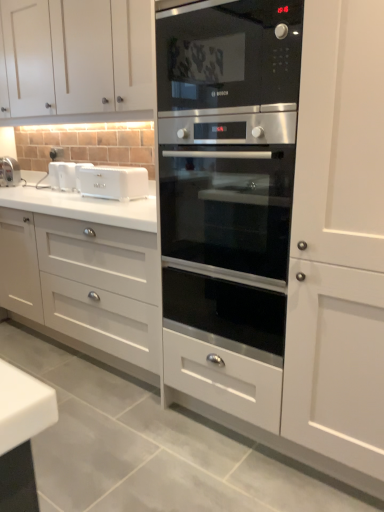
The width and height of the screenshot is (384, 512). Describe the element at coordinates (228, 168) in the screenshot. I see `stainless steel oven at center` at that location.

Locate an element on the screen. matte white faucet at left is located at coordinates (9, 172).

Locate an element on the screen. white matte cabinet at upper left is located at coordinates (75, 57).

This screenshot has height=512, width=384. Describe the element at coordinates (113, 182) in the screenshot. I see `white plastic toaster at center, which ranks as the 1th appliance in front-to-back order` at that location.

Measure the distance between white plastic toaster at left, acting as the 2th appliance starting from the front, and camera.

The distance of white plastic toaster at left, acting as the 2th appliance starting from the front, from camera is 2.84 meters.

Identify the location of white plastic toaster at left, the first appliance from the left. This screenshot has width=384, height=512. (62, 176).

Image resolution: width=384 pixels, height=512 pixels. I want to click on stainless steel oven at center, so click(x=228, y=168).

Is white matte cabinet at upper left oriented away from white plastic toaster at left, the first appliance from the left?

→ No.

From their relative heights in the image, would you say white matte cabinet at upper left is taller or shorter than white plastic toaster at left, which appears as the first appliance when viewed from the back?

In the image, white matte cabinet at upper left appears to be taller than white plastic toaster at left, which appears as the first appliance when viewed from the back.

Would you say white matte cabinet at upper left is a long distance from white plastic toaster at left, which appears as the first appliance when viewed from the back?

That's not correct — white matte cabinet at upper left is a little close to white plastic toaster at left, which appears as the first appliance when viewed from the back.

Considering the sizes of objects stainless steel oven at center and white matte cabinet at upper left in the image provided, who is wider, stainless steel oven at center or white matte cabinet at upper left?

With larger width is stainless steel oven at center.

The height and width of the screenshot is (512, 384). Identify the location of oven below the white matte cabinet at upper left (from a real-world perspective). (228, 168).

From the image's perspective, who appears lower, stainless steel oven at center or white matte cabinet at upper left?

stainless steel oven at center, from the image's perspective.

Is stainless steel oven at center spatially inside white matte cabinet at upper left, or outside of it?

stainless steel oven at center exists outside the volume of white matte cabinet at upper left.

How far apart are matte white faucet at left and black glass microwave at center?

They are 2.16 meters apart.

Looking at their sizes, would you say matte white faucet at left is wider or thinner than black glass microwave at center?

matte white faucet at left is thinner than black glass microwave at center.

Is black glass microwave at center inside matte white faucet at left?

That's incorrect, black glass microwave at center is not inside matte white faucet at left.

From the image's perspective, which object appears higher, matte white faucet at left or black glass microwave at center?

black glass microwave at center.

Could you tell me if matte white faucet at left is turned towards stainless steel oven at center?

No, matte white faucet at left is not aimed at stainless steel oven at center.

Looking at this image, which object is further away from the camera, matte white faucet at left or stainless steel oven at center?

matte white faucet at left is further away from the camera.

Does matte white faucet at left touch stainless steel oven at center?

matte white faucet at left is not next to stainless steel oven at center, and they're not touching.

Considering the relative sizes of matte white faucet at left and stainless steel oven at center in the image provided, is matte white faucet at left taller than stainless steel oven at center?

No, matte white faucet at left is not taller than stainless steel oven at center.

Considering the sizes of objects black glass microwave at center and white matte cabinet at upper left in the image provided, who is bigger, black glass microwave at center or white matte cabinet at upper left?

white matte cabinet at upper left is bigger.

Is point (189, 17) more distant than point (68, 25)?

No, it is not.

Which object is positioned more to the left, black glass microwave at center or white matte cabinet at upper left?

Positioned to the left is white matte cabinet at upper left.

Is black glass microwave at center thinner than white matte cabinet at upper left?

Yes.

Can you confirm if white plastic toaster at left, acting as the 2th appliance starting from the front, is smaller than white plastic toaster at center, the 2th appliance viewed from the left?

Indeed, white plastic toaster at left, acting as the 2th appliance starting from the front, has a smaller size compared to white plastic toaster at center, the 2th appliance viewed from the left.

How much distance is there between white plastic toaster at left, arranged as the 2th appliance when viewed from the right, and white plastic toaster at center, marked as the first appliance in a right-to-left arrangement?

14.43 inches.

Looking at this image, is white plastic toaster at left, which appears as the first appliance when viewed from the back, thinner than white plastic toaster at center, the second appliance in the back-to-front sequence?

Yes, white plastic toaster at left, which appears as the first appliance when viewed from the back, is thinner than white plastic toaster at center, the second appliance in the back-to-front sequence.

Considering the points (55, 170) and (96, 191), which point is in front, point (55, 170) or point (96, 191)?

The point (96, 191) is more forward.

Is white plastic toaster at left, acting as the 2th appliance starting from the front, oriented away from stainless steel oven at center?

No, white plastic toaster at left, acting as the 2th appliance starting from the front, is not facing away from stainless steel oven at center.

Who is smaller, white plastic toaster at left, which appears as the first appliance when viewed from the back, or stainless steel oven at center?

With smaller size is white plastic toaster at left, which appears as the first appliance when viewed from the back.

Considering the sizes of white plastic toaster at left, arranged as the 2th appliance when viewed from the right, and stainless steel oven at center in the image, is white plastic toaster at left, arranged as the 2th appliance when viewed from the right, taller or shorter than stainless steel oven at center?

white plastic toaster at left, arranged as the 2th appliance when viewed from the right, is shorter than stainless steel oven at center.

From a real-world perspective, count 2nd appliances downward from the white matte cabinet at upper left and point to it. Please provide its 2D coordinates.

[(62, 176)]

Identify the location of cabinetry above the stainless steel oven at center (from a real-world perspective). (75, 57).

Considering their positions, is black glass microwave at center positioned closer to matte white faucet at left than white matte cabinet at upper left?

white matte cabinet at upper left.

Which object lies further to the anchor point white matte cabinet at upper left, stainless steel oven at center or matte white faucet at left?

matte white faucet at left is further to white matte cabinet at upper left.

Considering their positions, is white plastic toaster at center, the second appliance in the back-to-front sequence, positioned further to matte white faucet at left than stainless steel oven at center?

stainless steel oven at center lies further to matte white faucet at left than the other object.

Estimate the real-world distances between objects in this image. Which object is closer to white plastic toaster at center, the 2th appliance viewed from the left, white plastic toaster at left, arranged as the 2th appliance when viewed from the right, or white matte cabinet at upper left?

Based on the image, white plastic toaster at left, arranged as the 2th appliance when viewed from the right, appears to be nearer to white plastic toaster at center, the 2th appliance viewed from the left.

From the image, which object appears to be farther from white matte cabinet at upper left, matte white faucet at left or white plastic toaster at left, the first appliance from the left?

Among the two, matte white faucet at left is located further to white matte cabinet at upper left.

From the picture: Which object lies further to the anchor point white plastic toaster at center, marked as the first appliance in a right-to-left arrangement, white matte cabinet at upper left or matte white faucet at left?

matte white faucet at left is positioned further to the anchor white plastic toaster at center, marked as the first appliance in a right-to-left arrangement.

Which object lies further to the anchor point white plastic toaster at center, the 2th appliance viewed from the left, stainless steel oven at center or matte white faucet at left?

stainless steel oven at center lies further to white plastic toaster at center, the 2th appliance viewed from the left, than the other object.

Based on their spatial positions, is white matte cabinet at upper left or stainless steel oven at center further from white plastic toaster at left, the first appliance from the left?

The object further to white plastic toaster at left, the first appliance from the left, is stainless steel oven at center.

Where is `cabinetry between stainless steel oven at center and white plastic toaster at left, which appears as the first appliance when viewed from the back, in the front-back direction`? This screenshot has width=384, height=512. cabinetry between stainless steel oven at center and white plastic toaster at left, which appears as the first appliance when viewed from the back, in the front-back direction is located at coordinates (75, 57).

This screenshot has width=384, height=512. Find the location of `oven positioned between black glass microwave at center and matte white faucet at left from near to far`. oven positioned between black glass microwave at center and matte white faucet at left from near to far is located at coordinates (228, 168).

Where is `appliance situated between matte white faucet at left and white plastic toaster at center, which ranks as the 1th appliance in front-to-back order, from left to right`? The image size is (384, 512). appliance situated between matte white faucet at left and white plastic toaster at center, which ranks as the 1th appliance in front-to-back order, from left to right is located at coordinates (62, 176).

Find the location of a particular element. This screenshot has width=384, height=512. cabinetry between black glass microwave at center and white plastic toaster at center, the 2th appliance viewed from the left, in the front-back direction is located at coordinates (75, 57).